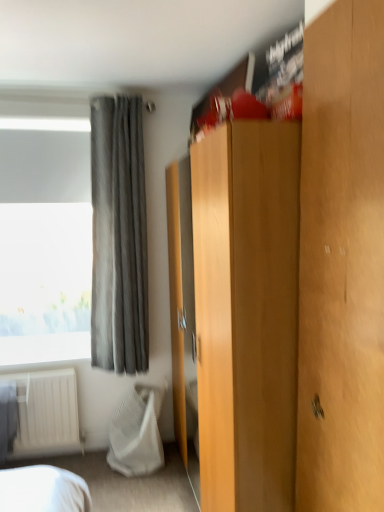
Question: Does wooden door at right have a smaller size compared to gray fabric curtain at upper left?

Choices:
 (A) no
 (B) yes

Answer: (B)

Question: Is wooden door at right not within gray fabric curtain at upper left?

Choices:
 (A) yes
 (B) no

Answer: (A)

Question: Does wooden door at right appear on the left side of gray fabric curtain at upper left?

Choices:
 (A) yes
 (B) no

Answer: (B)

Question: Considering the relative positions of wooden door at right and gray fabric curtain at upper left in the image provided, is wooden door at right behind gray fabric curtain at upper left?

Choices:
 (A) yes
 (B) no

Answer: (B)

Question: From a real-world perspective, is wooden door at right on gray fabric curtain at upper left?

Choices:
 (A) yes
 (B) no

Answer: (B)

Question: Relative to light brown wood dresser at center, is white textured blanket at lower left in front or behind?

Choices:
 (A) behind
 (B) front

Answer: (A)

Question: Considering the positions of white textured blanket at lower left and light brown wood dresser at center in the image, is white textured blanket at lower left taller or shorter than light brown wood dresser at center?

Choices:
 (A) tall
 (B) short

Answer: (B)

Question: From a real-world perspective, relative to light brown wood dresser at center, is white textured blanket at lower left vertically above or below?

Choices:
 (A) below
 (B) above

Answer: (A)

Question: Considering the positions of white textured blanket at lower left and light brown wood dresser at center in the image, is white textured blanket at lower left wider or thinner than light brown wood dresser at center?

Choices:
 (A) wide
 (B) thin

Answer: (B)

Question: Considering the positions of wooden door at right and gray fabric curtain at upper left in the image, is wooden door at right wider or thinner than gray fabric curtain at upper left?

Choices:
 (A) thin
 (B) wide

Answer: (A)

Question: From the image's perspective, relative to gray fabric curtain at upper left, is wooden door at right above or below?

Choices:
 (A) above
 (B) below

Answer: (B)

Question: Based on their sizes in the image, would you say wooden door at right is bigger or smaller than gray fabric curtain at upper left?

Choices:
 (A) big
 (B) small

Answer: (B)

Question: Is point (309, 367) closer or farther from the camera than point (122, 269)?

Choices:
 (A) farther
 (B) closer

Answer: (B)

Question: In terms of size, does white textured blanket at lower left appear bigger or smaller than gray fabric curtain at upper left?

Choices:
 (A) big
 (B) small

Answer: (B)

Question: From a real-world perspective, is white textured blanket at lower left physically located above or below gray fabric curtain at upper left?

Choices:
 (A) above
 (B) below

Answer: (B)